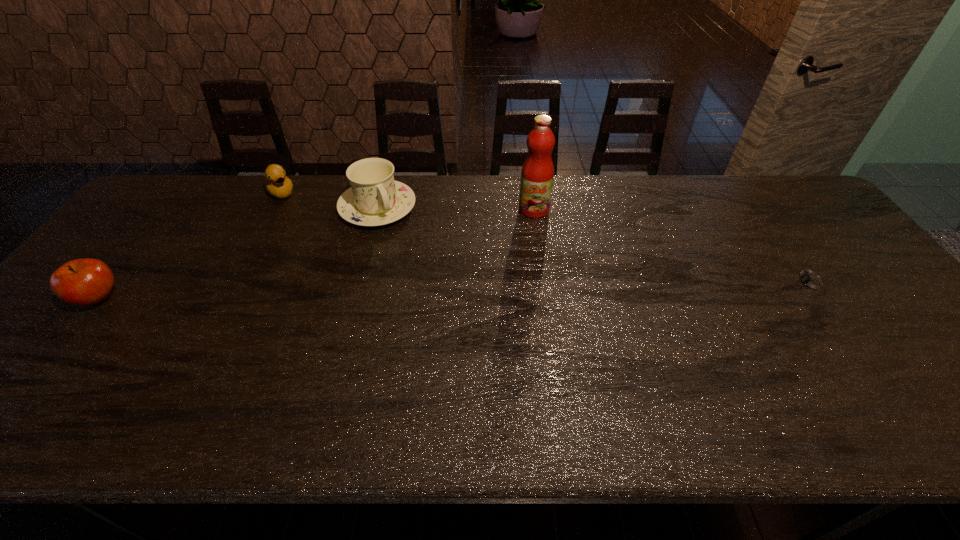
Find the location of a particular element. The image size is (960, 540). vacant region located 0.250m on the face of the shortest object is located at coordinates (693, 283).

This screenshot has height=540, width=960. Find the location of `free region located on the front label of the tallest object`. free region located on the front label of the tallest object is located at coordinates (510, 272).

Find the location of a particular element. The height and width of the screenshot is (540, 960). vacant space located on the front label of the tallest object is located at coordinates 510,272.

Locate an element on the screen. This screenshot has height=540, width=960. free spot located on the front label of the tallest object is located at coordinates (523, 237).

Where is `vacant space located on the handle side of the third object from left to right`? This screenshot has width=960, height=540. vacant space located on the handle side of the third object from left to right is located at coordinates (449, 308).

Find the location of a particular element. free region located 0.230m on the handle side of the third object from left to right is located at coordinates (426, 276).

Locate an element on the screen. vacant space located on the handle side of the third object from left to right is located at coordinates (399, 238).

At what (x,y) coordinates should I click in order to perform the action: click on vacant space located 0.270m facing forward on the fourth object from right to left. Please return your answer as a coordinate pair (x, y). This screenshot has height=540, width=960. Looking at the image, I should click on (321, 245).

Where is `blank space located 0.320m facing forward on the fourth object from right to left`? This screenshot has height=540, width=960. blank space located 0.320m facing forward on the fourth object from right to left is located at coordinates (328, 254).

Where is `free region located facing forward on the fourth object from right to left`? The height and width of the screenshot is (540, 960). free region located facing forward on the fourth object from right to left is located at coordinates (333, 260).